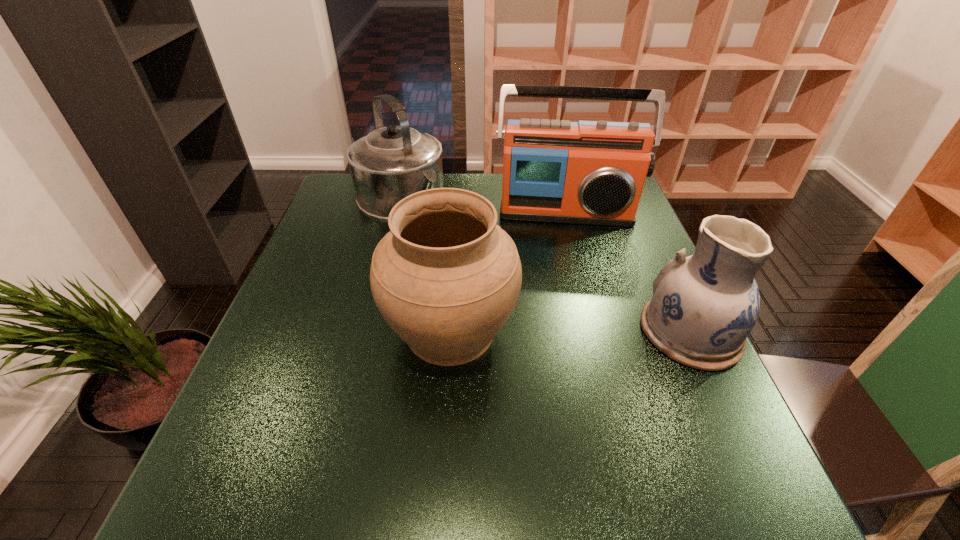
At what (x,y) coordinates should I click in order to perform the action: click on vacant space at the near edge of the desktop. Please return your answer as a coordinate pair (x, y). The width and height of the screenshot is (960, 540). Looking at the image, I should click on (420, 450).

In the image, there is a desktop. Identify the location of vacant space at the left edge. 321,281.

This screenshot has height=540, width=960. In the image, there is a desktop. What are the coordinates of `vacant area at the right edge` in the screenshot? It's located at (621, 240).

Find the location of a particular element. vacant area that lies between the kettle and the pottery is located at coordinates (545, 266).

The image size is (960, 540). I want to click on empty location between the urn and the pottery, so (570, 331).

Where is `free space that is in between the kettle and the pottery`? The height and width of the screenshot is (540, 960). free space that is in between the kettle and the pottery is located at coordinates (545, 266).

Image resolution: width=960 pixels, height=540 pixels. Identify the location of vacant space in between the pottery and the urn. (570, 331).

Locate an element on the screen. object that is the nearest to the urn is located at coordinates (390, 163).

Identify the location of object that is the third closest to the radio receiver. (704, 306).

Where is `free region that satisfies the following two spatial constraints: 1. on the front side of the pottery; 2. on the right side of the kettle`? The image size is (960, 540). free region that satisfies the following two spatial constraints: 1. on the front side of the pottery; 2. on the right side of the kettle is located at coordinates (367, 332).